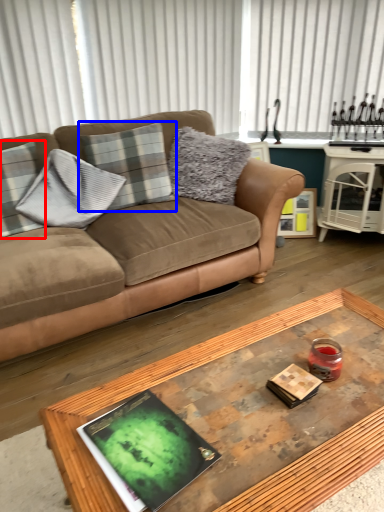
Question: Which object appears closest to the camera in this image, pillow (highlighted by a red box) or pillow (highlighted by a blue box)?

Choices:
 (A) pillow
 (B) pillow

Answer: (A)